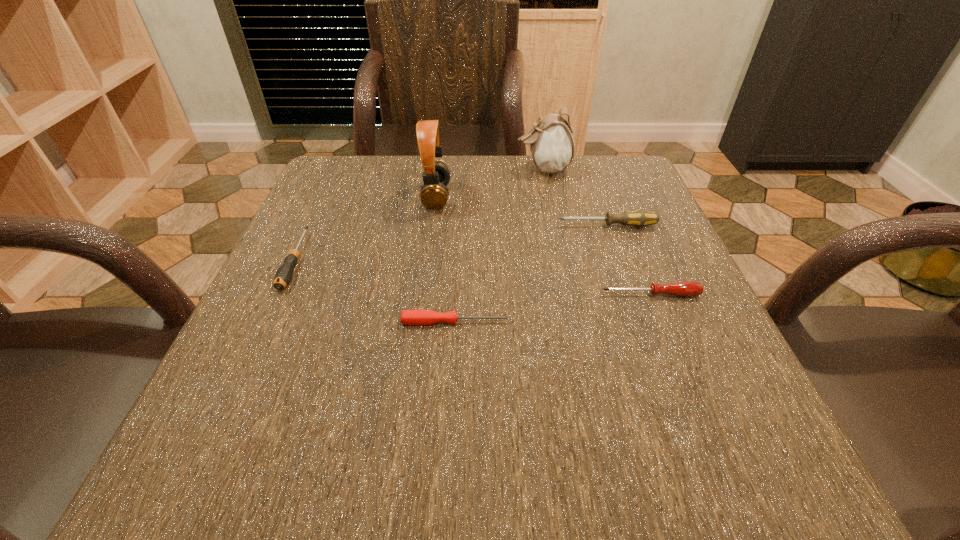
Image resolution: width=960 pixels, height=540 pixels. In order to click on the fifth nearest object in this screenshot , I will do `click(434, 194)`.

Where is `the farthest object`? The height and width of the screenshot is (540, 960). the farthest object is located at coordinates (552, 146).

Find the location of a particular element. The image size is (960, 540). pouch is located at coordinates (552, 146).

You are a GUI agent. You are given a task and a screenshot of the screen. Output one action in this format:
    pyautogui.click(x=<x>, y=<y>)
    Task: Click on the tallest screwdriver
    
    Given the screenshot: What is the action you would take?
    pyautogui.click(x=640, y=218)

The height and width of the screenshot is (540, 960). I want to click on the fourth shortest object, so click(640, 218).

The width and height of the screenshot is (960, 540). In order to click on the leftmost object in this screenshot , I will do `click(283, 276)`.

The height and width of the screenshot is (540, 960). Find the location of `the shortest object`. the shortest object is located at coordinates (408, 317).

Where is `the shortest screwdriver`? The image size is (960, 540). the shortest screwdriver is located at coordinates (408, 317).

Locate an element on the screen. The image size is (960, 540). vacant region located on the ear cups of the headset is located at coordinates tap(521, 197).

Identify the location of free space located on the front-facing side of the second tallest object. (362, 169).